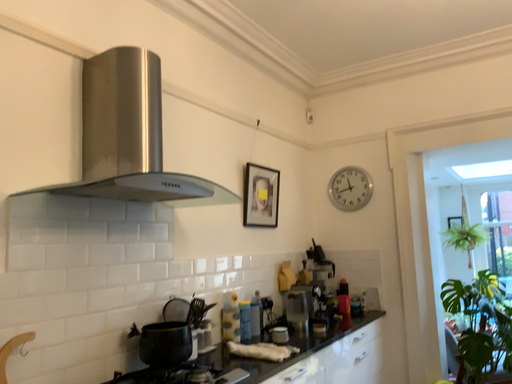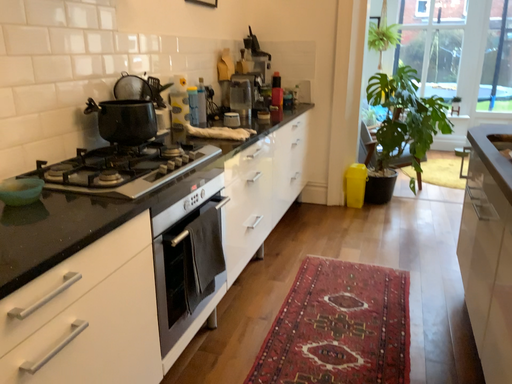
Question: How did the camera likely rotate when shooting the video?

Choices:
 (A) rotated left
 (B) rotated right

Answer: (B)